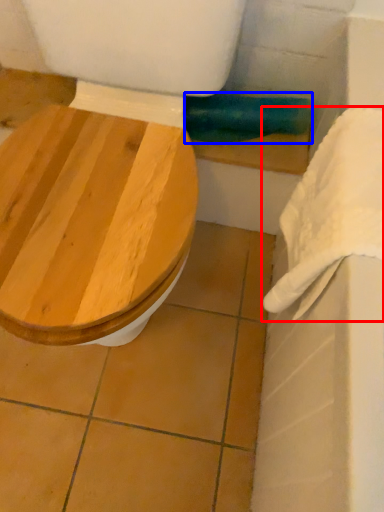
Question: Which object appears farthest to the camera in this image, towel/napkin (highlighted by a red box) or towel bar (highlighted by a blue box)?

Choices:
 (A) towel/napkin
 (B) towel bar

Answer: (B)